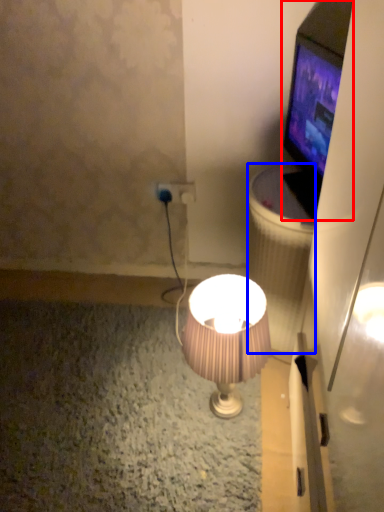
Question: Which object is further to the camera taking this photo, television (highlighted by a red box) or trash bin/can (highlighted by a blue box)?

Choices:
 (A) television
 (B) trash bin/can

Answer: (B)